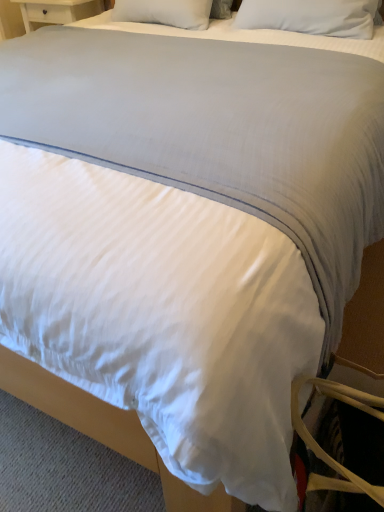
Question: Can you confirm if tan leather swivel chair at lower right is thinner than white soft pillow at upper center, placed as the first pillow when sorted from left to right?

Choices:
 (A) yes
 (B) no

Answer: (B)

Question: Are tan leather swivel chair at lower right and white soft pillow at upper center, the second pillow positioned from the right, located far from each other?

Choices:
 (A) no
 (B) yes

Answer: (B)

Question: Is tan leather swivel chair at lower right looking in the opposite direction of white soft pillow at upper center, the second pillow positioned from the right?

Choices:
 (A) yes
 (B) no

Answer: (B)

Question: Is tan leather swivel chair at lower right wider than white soft pillow at upper center, placed as the first pillow when sorted from left to right?

Choices:
 (A) yes
 (B) no

Answer: (A)

Question: Considering the relative sizes of tan leather swivel chair at lower right and white soft pillow at upper center, the second pillow positioned from the right, in the image provided, is tan leather swivel chair at lower right taller than white soft pillow at upper center, the second pillow positioned from the right,?

Choices:
 (A) yes
 (B) no

Answer: (A)

Question: Is tan leather swivel chair at lower right further to the viewer compared to white soft pillow at upper center, the second pillow positioned from the right?

Choices:
 (A) no
 (B) yes

Answer: (A)

Question: From a real-world perspective, does white soft pillow at upper center, placed as the first pillow when sorted from left to right, stand above white soft pillow at upper center, which ranks as the 1th pillow in right-to-left order?

Choices:
 (A) yes
 (B) no

Answer: (B)

Question: Is white soft pillow at upper center, the second pillow positioned from the right, far from white soft pillow at upper center, the second pillow viewed from the left?

Choices:
 (A) no
 (B) yes

Answer: (A)

Question: Considering the relative sizes of white soft pillow at upper center, placed as the first pillow when sorted from left to right, and white soft pillow at upper center, which ranks as the 1th pillow in right-to-left order, in the image provided, is white soft pillow at upper center, placed as the first pillow when sorted from left to right, thinner than white soft pillow at upper center, which ranks as the 1th pillow in right-to-left order,?

Choices:
 (A) no
 (B) yes

Answer: (A)

Question: Can you confirm if white soft pillow at upper center, placed as the first pillow when sorted from left to right, is positioned to the right of white soft pillow at upper center, which ranks as the 1th pillow in right-to-left order?

Choices:
 (A) yes
 (B) no

Answer: (B)

Question: Is white soft pillow at upper center, placed as the first pillow when sorted from left to right, touching white soft pillow at upper center, the second pillow viewed from the left?

Choices:
 (A) yes
 (B) no

Answer: (B)

Question: Considering the relative sizes of white soft pillow at upper center, the second pillow positioned from the right, and white soft pillow at upper center, the second pillow viewed from the left, in the image provided, is white soft pillow at upper center, the second pillow positioned from the right, bigger than white soft pillow at upper center, the second pillow viewed from the left,?

Choices:
 (A) no
 (B) yes

Answer: (A)

Question: Is tan leather swivel chair at lower right to the right of white soft pillow at upper center, which ranks as the 1th pillow in right-to-left order, from the viewer's perspective?

Choices:
 (A) no
 (B) yes

Answer: (A)